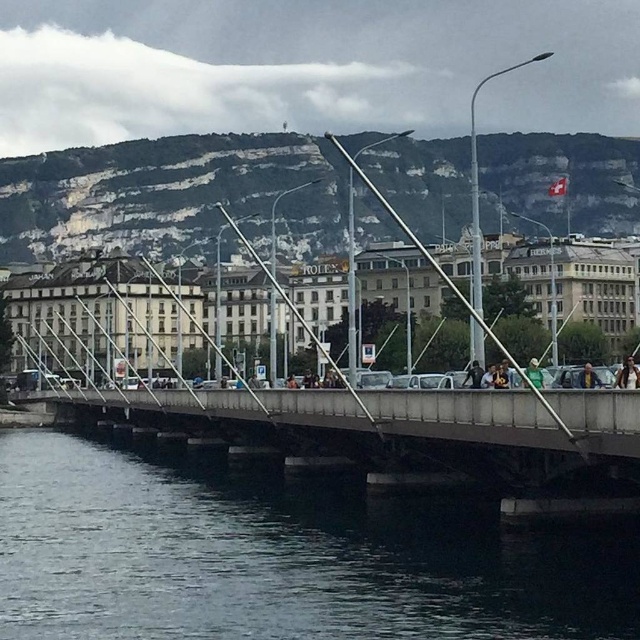
Based on the photo, you are standing on the pedestrian bridge and looking at two points on the bridge. The first point is at coordinates point (621, 365) and the second point is at point (540, 372). Which point is closer to you?

Point (540, 372) is closer to you because it is less further to the camera than point (621, 365).

You are a photographer planning to take a portrait of a person wearing a light brown leather jacket at center and a green fabric at center. Which clothing item will appear larger in the photo?

The light brown leather jacket at center will appear larger in the photo because it has a larger size compared to the green fabric at center.